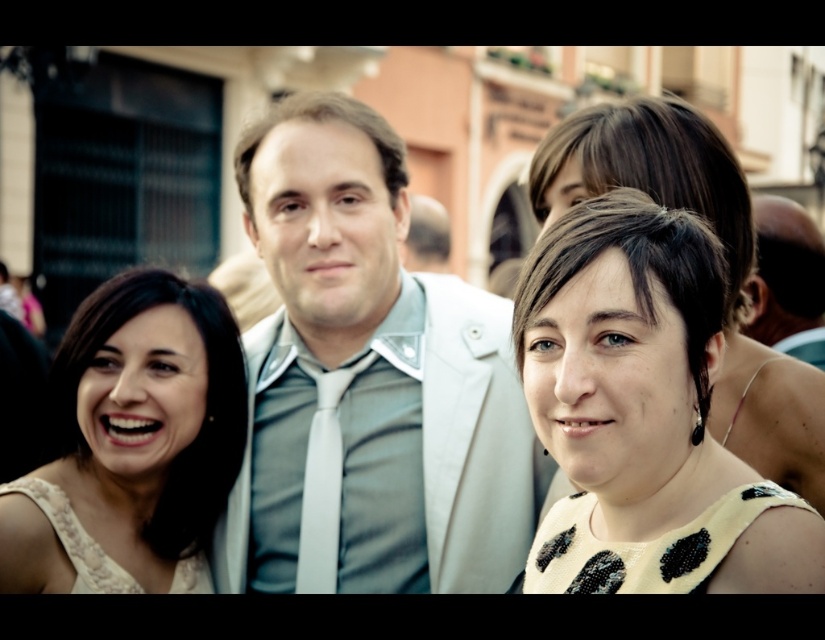
You are a photographer trying to capture a candid shot of the two main subjects in the scene. The yellow dotted dress at center and the matte white suit at center are your focus. Based on their positions, which subject is positioned lower in the frame?

The yellow dotted dress at center is located below the matte white suit at center, so the subject wearing the yellow dotted dress at center is positioned lower in the frame.

You are a photographer setting up for a group photo. You have two items to adjust in the scene described. The matte beige dress at center and the white silk tie at center. Which item is positioned higher in the frame?

The matte beige dress at center is much taller than the white silk tie at center, so it is positioned higher in the frame.

You are a photographer setting up a shot for a magazine cover. You need to place a golden award plaque between the yellow dotted dress at center and the matte white suit at center. Since the plaque is 1.2 meters wide, will it fit between them?

The yellow dotted dress at center has a lesser width compared to matte white suit at center. The total width between them would be the sum of both widths. Since the plaque is 1.2 meters wide, it should fit as the combined width of the two objects is likely larger than 1.2 meters.